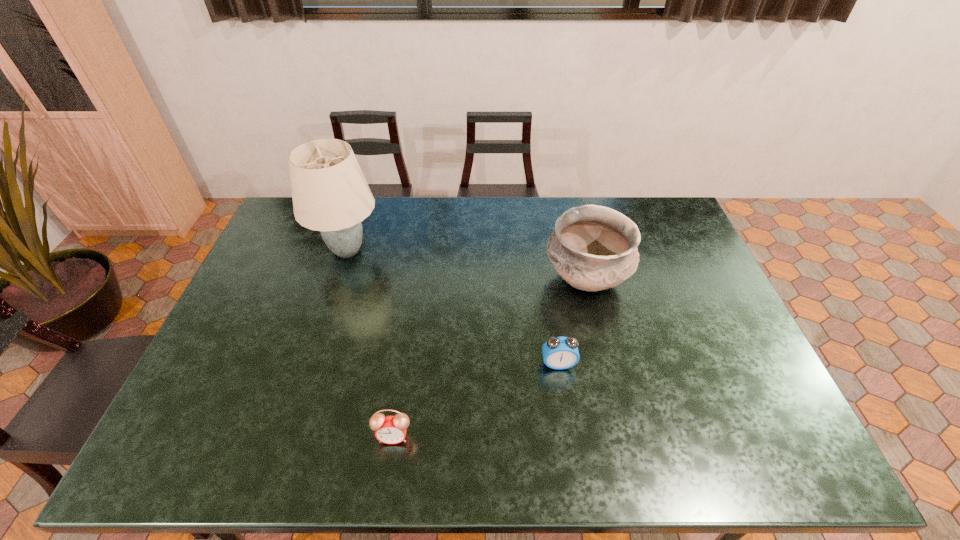
I want to click on free area in between the third farthest object and the nearer alarm clock, so click(x=476, y=400).

The image size is (960, 540). In order to click on empty space between the pottery and the lampshade in this screenshot , I will do `click(467, 265)`.

Find the location of a particular element. vacant point located between the tallest object and the second tallest object is located at coordinates (467, 265).

Locate an element on the screen. free point between the pottery and the left alarm clock is located at coordinates [490, 358].

You are a GUI agent. You are given a task and a screenshot of the screen. Output one action in this format:
    pyautogui.click(x=<x>, y=<y>)
    Task: Click on the vacant space in between the tallest object and the pottery
    The height and width of the screenshot is (540, 960).
    Given the screenshot: What is the action you would take?
    click(x=467, y=265)

Identify the location of vacant area that lies between the pottery and the left alarm clock. This screenshot has height=540, width=960. (490, 358).

Identify the location of free spot between the tallest object and the third farthest object. The width and height of the screenshot is (960, 540). (453, 307).

Locate an element on the screen. The height and width of the screenshot is (540, 960). unoccupied position between the farther alarm clock and the tallest object is located at coordinates coord(453,307).

Point out which object is positioned as the third nearest to the pottery. Please provide its 2D coordinates. Your answer should be formatted as a tuple, i.e. [(x, y)], where the tuple contains the x and y coordinates of a point satisfying the conditions above.

[(330, 194)]

Where is `the third closest object relative to the leftmost object`? the third closest object relative to the leftmost object is located at coordinates (559, 353).